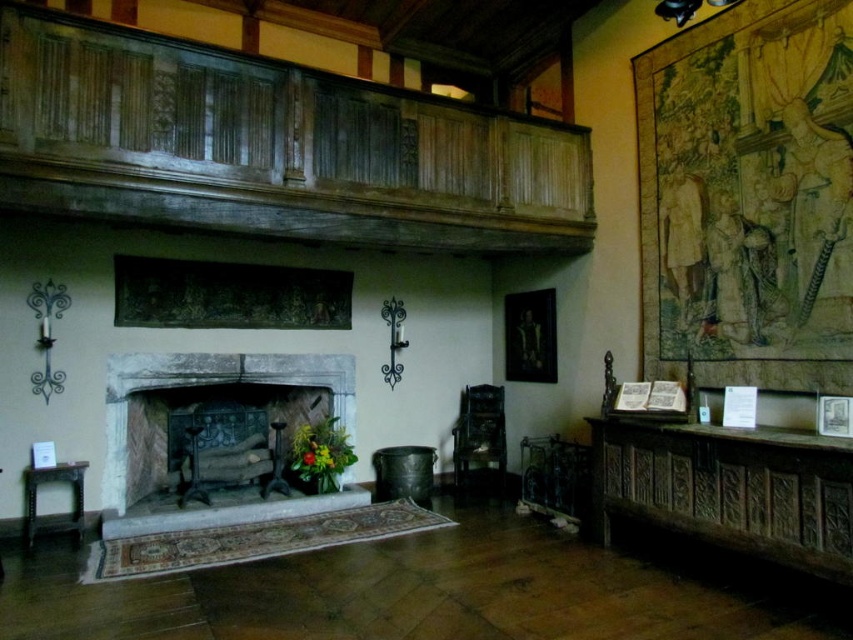
In the scene shown: You are an interior designer planning to place a decorative item on the weathered wood mantle at upper center and the stone fireplace at center. Based on their positions, where should you place a larger item to ensure it doesn not block the view of the tapestry on the wall behind?

The weathered wood mantle at upper center is positioned on the right side of the stone fireplace at center. To avoid blocking the view of the tapestry, place the larger item on the stone fireplace at center since it is wider and can accommodate the item without obstructing the tapestry behind.

You are a guest in this historical room and want to place a decorative item on the surface closest to the ceiling. Which object should you choose between the weathered wood mantle at upper center and the dark wood carved chest at lower right?

The weathered wood mantle at upper center is located above the dark wood carved chest at lower right, so the mantle is closer to the ceiling. Therefore, you should place the decorative item on the weathered wood mantle at upper center.

You are standing in the room and want to move a large painting from the wall to the space between the dark wood carved chest at lower right and the stone fireplace at center. Considering their sizes, will the painting fit in that space?

The dark wood carved chest at lower right is thinner than the stone fireplace at center, so the space between them may accommodate the painting depending on the painting size. However, the exact dimensions are not provided, so it is uncertain.